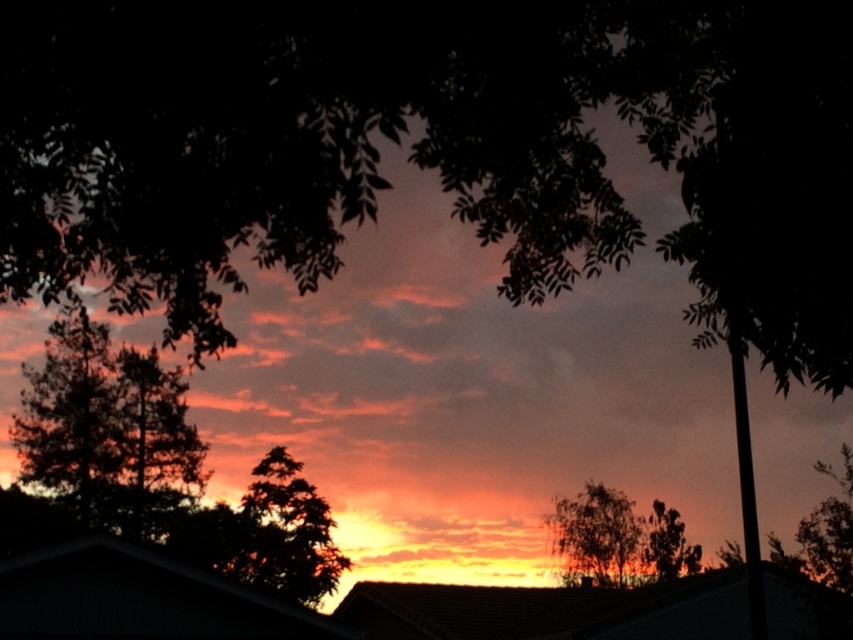
Question: Which point is closer to the camera?

Choices:
 (A) dark green leafy tree at left
 (B) green textured tree at left
 (C) silvery metallic tree at center

Answer: (A)

Question: Is dark green leafy tree at left below green textured tree at left?

Choices:
 (A) yes
 (B) no

Answer: (B)

Question: From the image, what is the correct spatial relationship of green textured tree at left in relation to green leafy tree at center?

Choices:
 (A) above
 (B) below

Answer: (A)

Question: Which point is closer to the camera?

Choices:
 (A) (90, 513)
 (B) (166, 470)

Answer: (A)

Question: Is dark green leafy tree at left to the right of green leafy tree at center from the viewer's perspective?

Choices:
 (A) no
 (B) yes

Answer: (A)

Question: Which point is closer to the camera?

Choices:
 (A) green textured tree at left
 (B) green leafy tree at center

Answer: (A)